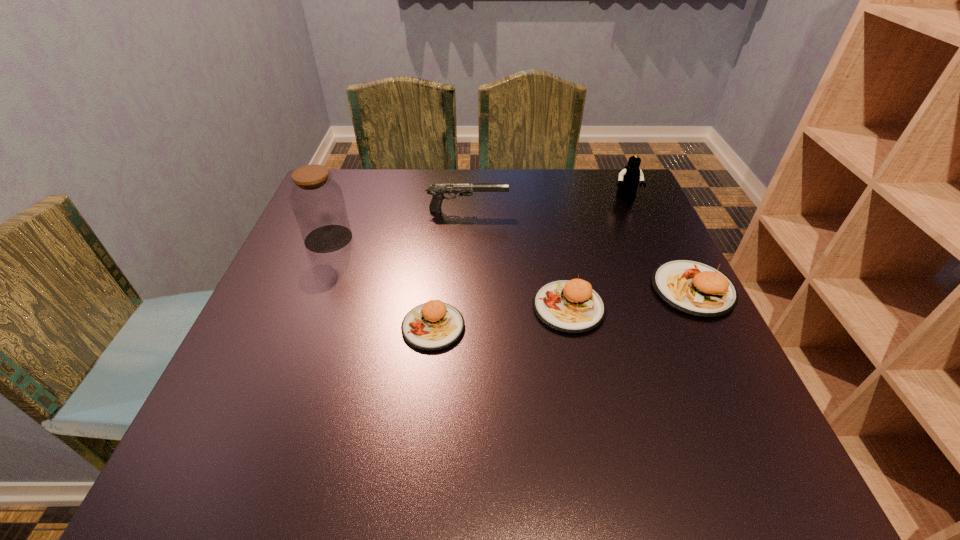
With all pattys evenly spaced, where should an extra patty be placed on the left to continue the pattern? Please point out a vacant space. Please provide its 2D coordinates. Your answer should be formatted as a tuple, i.e. [(x, y)], where the tuple contains the x and y coordinates of a point satisfying the conditions above.

[(285, 348)]